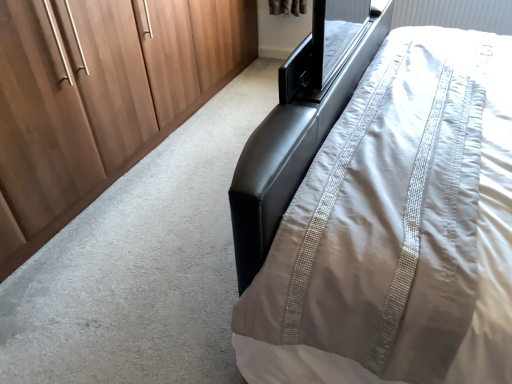
Question: Is there a large distance between satin white bed at right and matte wood wardrobe at left?

Choices:
 (A) yes
 (B) no

Answer: (A)

Question: Is matte wood wardrobe at left at the back of satin white bed at right?

Choices:
 (A) yes
 (B) no

Answer: (A)

Question: Considering the relative sizes of satin white bed at right and matte wood wardrobe at left in the image provided, is satin white bed at right wider than matte wood wardrobe at left?

Choices:
 (A) no
 (B) yes

Answer: (A)

Question: Can you confirm if satin white bed at right is smaller than matte wood wardrobe at left?

Choices:
 (A) yes
 (B) no

Answer: (A)

Question: From a real-world perspective, is satin white bed at right below matte wood wardrobe at left?

Choices:
 (A) yes
 (B) no

Answer: (B)

Question: From the image's perspective, does satin white bed at right appear higher than matte wood wardrobe at left?

Choices:
 (A) yes
 (B) no

Answer: (B)

Question: Is matte wood wardrobe at left aimed at satin white bed at right?

Choices:
 (A) no
 (B) yes

Answer: (B)

Question: From the image's perspective, is matte wood wardrobe at left below satin white bed at right?

Choices:
 (A) no
 (B) yes

Answer: (A)

Question: Would you consider matte wood wardrobe at left to be distant from satin white bed at right?

Choices:
 (A) no
 (B) yes

Answer: (B)

Question: Is matte wood wardrobe at left bigger than satin white bed at right?

Choices:
 (A) no
 (B) yes

Answer: (B)

Question: Is matte wood wardrobe at left not within satin white bed at right?

Choices:
 (A) no
 (B) yes

Answer: (B)

Question: Is matte wood wardrobe at left shorter than satin white bed at right?

Choices:
 (A) yes
 (B) no

Answer: (B)

Question: From a real-world perspective, is matte wood wardrobe at left positioned above or below satin white bed at right?

Choices:
 (A) below
 (B) above

Answer: (A)